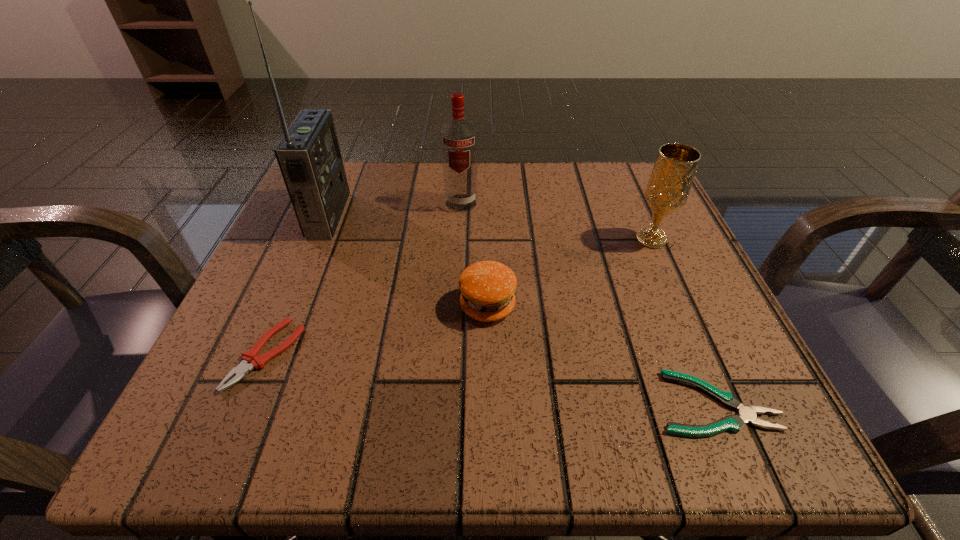
I want to click on the closest object to the second shortest object, so click(308, 155).

Locate an element on the screen. blank space that satisfies the following two spatial constraints: 1. on the front label of the shortest object; 2. on the right side of the second tallest object is located at coordinates (450, 403).

The width and height of the screenshot is (960, 540). What are the coordinates of `free space that satisfies the following two spatial constraints: 1. on the display of the radio receiver; 2. on the left side of the fourth shortest object` in the screenshot? It's located at tap(319, 240).

Find the location of a particular element. This screenshot has height=540, width=960. vacant space that satisfies the following two spatial constraints: 1. on the display of the fourth shortest object; 2. on the left side of the radio receiver is located at coordinates (319, 240).

Locate an element on the screen. vacant space that satisfies the following two spatial constraints: 1. on the display of the radio receiver; 2. on the right side of the shorter pliers is located at coordinates pos(251,403).

I want to click on vacant space that satisfies the following two spatial constraints: 1. on the back side of the fourth tallest object; 2. on the left side of the chalice, so point(487,240).

This screenshot has height=540, width=960. I want to click on free spot that satisfies the following two spatial constraints: 1. on the front label of the chalice; 2. on the right side of the second tallest object, so click(459, 240).

Locate an element on the screen. Image resolution: width=960 pixels, height=540 pixels. free location that satisfies the following two spatial constraints: 1. on the front label of the chalice; 2. on the left side of the vodka is located at coordinates (459, 240).